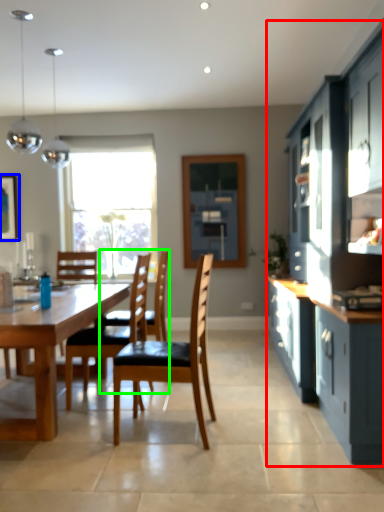
Question: Based on their relative distances, which object is farther from cabinetry (highlighted by a red box)? Choose from picture frame (highlighted by a blue box) and chair (highlighted by a green box).

Choices:
 (A) picture frame
 (B) chair

Answer: (A)